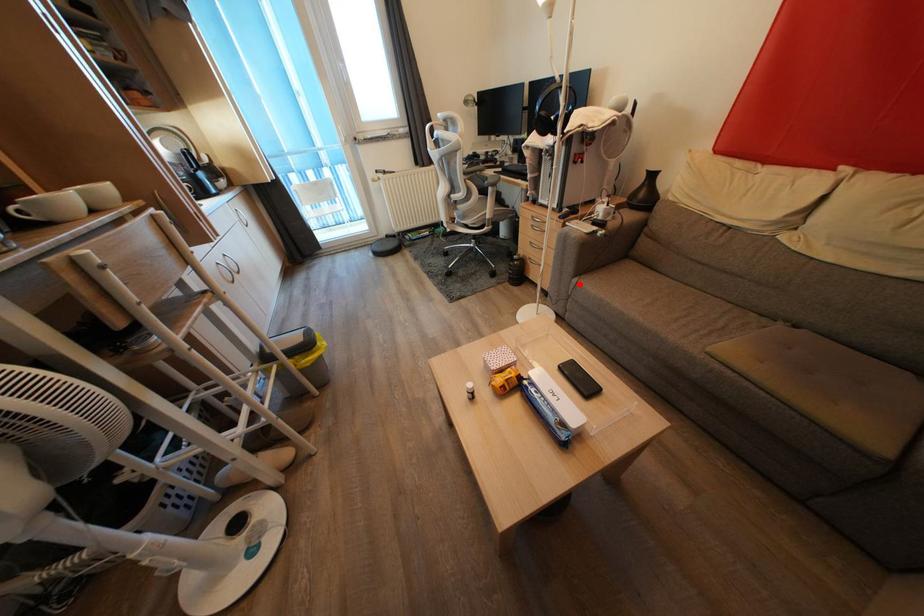
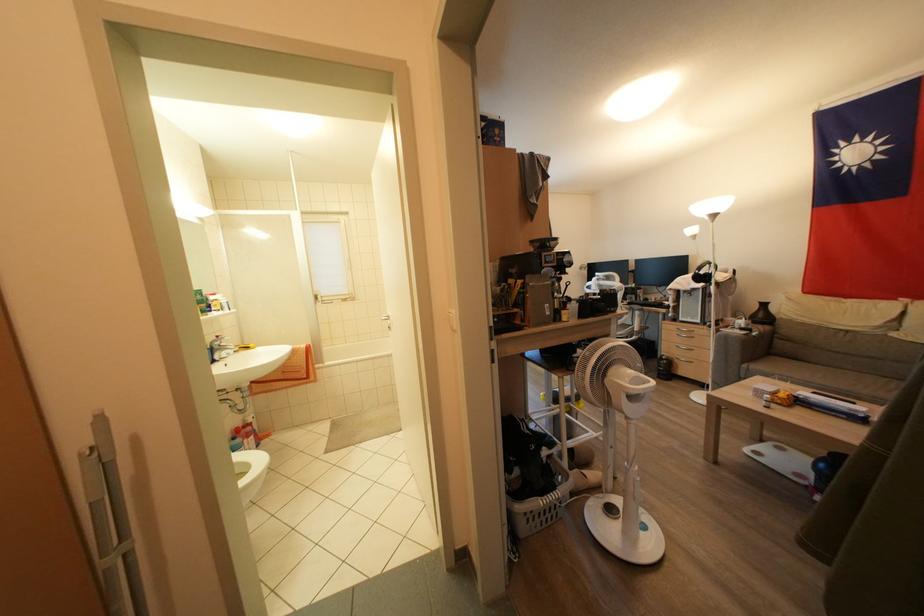
Question: A red point is marked in image1. In image2, is the corresponding 3D point closer to the camera or farther? Reply with the corresponding letter.

Choices:
 (A) The corresponding 3D point is closer.
 (B) The corresponding 3D point is farther.

Answer: (B)